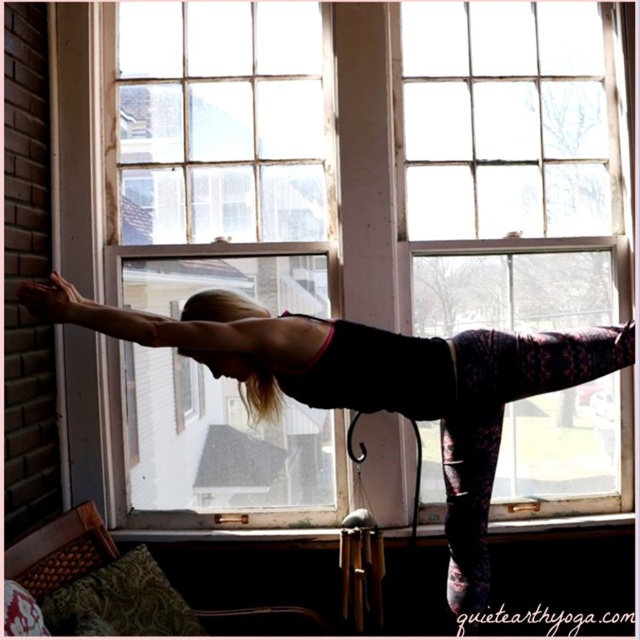
Question: Does clear glass window at center have a greater width compared to black matte yoga pants at center?

Choices:
 (A) yes
 (B) no

Answer: (B)

Question: Among these points, which one is farthest from the camera?

Choices:
 (A) (124, 211)
 (B) (120, 323)

Answer: (A)

Question: Which point is farther to the camera?

Choices:
 (A) black matte yoga pants at center
 (B) clear glass window at center

Answer: (B)

Question: Can you confirm if clear glass window at center is positioned to the left of black matte yoga pants at center?

Choices:
 (A) yes
 (B) no

Answer: (A)

Question: Is clear glass window at center positioned behind black matte yoga pants at center?

Choices:
 (A) no
 (B) yes

Answer: (B)